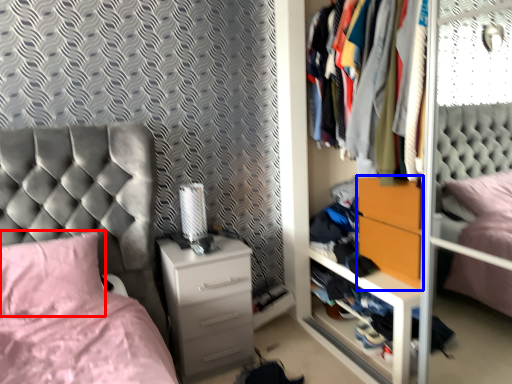
Question: Which of the following is the farthest to the observer, pillow (highlighted by a red box) or nightstand (highlighted by a blue box)?

Choices:
 (A) pillow
 (B) nightstand

Answer: (B)